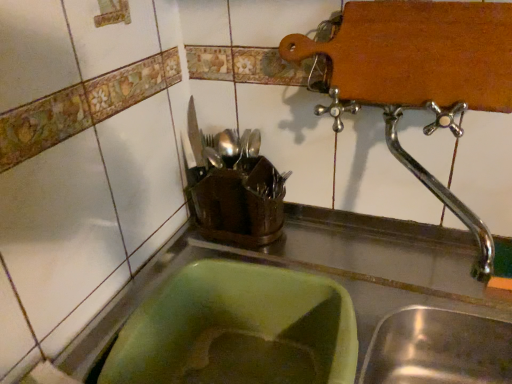
Find the location of `shiny silver cutlery at center, the 1th tableware from the right`. shiny silver cutlery at center, the 1th tableware from the right is located at coordinates pos(228,147).

At what (x,y) coordinates should I click in order to perform the action: click on metallic knife at upper center, marked as the 1th tableware in a left-to-right arrangement. Please return your answer as a coordinate pair (x, y). Looking at the image, I should click on 195,136.

At what (x,y) coordinates should I click in order to perform the action: click on green plastic sink at lower left. Please return your answer as a coordinate pair (x, y). Looking at the image, I should click on (319, 272).

This screenshot has width=512, height=384. Identify the location of shiny silver cutlery at center, marked as the 2th tableware in a left-to-right arrangement. (228, 147).

Is polished chrome tap at upper right smaller than shiny silver cutlery at center, the 1th tableware from the right?

No.

Can you tell me how much polished chrome tap at upper right and shiny silver cutlery at center, marked as the 2th tableware in a left-to-right arrangement, differ in facing direction?

2.29 degrees.

Which is correct: polished chrome tap at upper right is inside shiny silver cutlery at center, the 1th tableware from the right, or outside of it?

polished chrome tap at upper right is spatially situated outside shiny silver cutlery at center, the 1th tableware from the right.

Between polished chrome tap at upper right and metallic knife at upper center, which ranks as the 2th tableware in right-to-left order, which one has more height?

Standing taller between the two is polished chrome tap at upper right.

Is metallic knife at upper center, marked as the 1th tableware in a left-to-right arrangement, inside polished chrome tap at upper right?

No, polished chrome tap at upper right does not contain metallic knife at upper center, marked as the 1th tableware in a left-to-right arrangement.

Which of these two, polished chrome tap at upper right or metallic knife at upper center, marked as the 1th tableware in a left-to-right arrangement, is smaller?

metallic knife at upper center, marked as the 1th tableware in a left-to-right arrangement, is smaller.

From the image's perspective, is polished chrome tap at upper right below metallic knife at upper center, which ranks as the 2th tableware in right-to-left order?

Yes, from the image's perspective, polished chrome tap at upper right is below metallic knife at upper center, which ranks as the 2th tableware in right-to-left order.

Can you confirm if shiny silver cutlery at center, marked as the 2th tableware in a left-to-right arrangement, is bigger than green plastic sink at lower left?

No.

Between point (222, 159) and point (240, 249), which one is positioned in front?

The point (240, 249) is closer to the camera.

Are shiny silver cutlery at center, marked as the 2th tableware in a left-to-right arrangement, and green plastic sink at lower left beside each other?

shiny silver cutlery at center, marked as the 2th tableware in a left-to-right arrangement, is not next to green plastic sink at lower left, and they're not touching.

Does point (361, 334) come closer to viewer compared to point (223, 153)?

Yes, point (361, 334) is in front of point (223, 153).

Considering the sizes of objects green plastic sink at lower left and shiny silver cutlery at center, the 1th tableware from the right, in the image provided, who is bigger, green plastic sink at lower left or shiny silver cutlery at center, the 1th tableware from the right,?

Bigger between the two is green plastic sink at lower left.

From the image's perspective, starting from the green plastic sink at lower left, which tableware is the 1st one above? Please provide its 2D coordinates.

[(228, 147)]

Does green plastic sink at lower left come in front of shiny silver cutlery at center, marked as the 2th tableware in a left-to-right arrangement?

Yes, it is in front of shiny silver cutlery at center, marked as the 2th tableware in a left-to-right arrangement.

Consider the image. Is green plastic sink at lower left not inside polished chrome tap at upper right?

Absolutely, green plastic sink at lower left is external to polished chrome tap at upper right.

I want to click on tap that is behind the green plastic sink at lower left, so click(442, 196).

How many degrees apart are the facing directions of green plastic sink at lower left and polished chrome tap at upper right?

0.749 degrees.

Could you tell me if metallic knife at upper center, which ranks as the 2th tableware in right-to-left order, is turned towards shiny silver cutlery at center, the 1th tableware from the right?

No, metallic knife at upper center, which ranks as the 2th tableware in right-to-left order, is not oriented towards shiny silver cutlery at center, the 1th tableware from the right.

From a real-world perspective, does metallic knife at upper center, marked as the 1th tableware in a left-to-right arrangement, sit lower than shiny silver cutlery at center, marked as the 2th tableware in a left-to-right arrangement?

No, from a real-world perspective, metallic knife at upper center, marked as the 1th tableware in a left-to-right arrangement, is not under shiny silver cutlery at center, marked as the 2th tableware in a left-to-right arrangement.

Does point (196, 162) come in front of point (226, 160)?

No, (196, 162) is further to viewer.

Considering the sizes of objects metallic knife at upper center, marked as the 1th tableware in a left-to-right arrangement, and polished chrome tap at upper right in the image provided, who is taller, metallic knife at upper center, marked as the 1th tableware in a left-to-right arrangement, or polished chrome tap at upper right?

Standing taller between the two is polished chrome tap at upper right.

From a real-world perspective, relative to polished chrome tap at upper right, is metallic knife at upper center, which ranks as the 2th tableware in right-to-left order, vertically above or below?

metallic knife at upper center, which ranks as the 2th tableware in right-to-left order, is situated lower than polished chrome tap at upper right in the real world.

Looking at this image, between metallic knife at upper center, marked as the 1th tableware in a left-to-right arrangement, and polished chrome tap at upper right, which one appears on the left side from the viewer's perspective?

metallic knife at upper center, marked as the 1th tableware in a left-to-right arrangement.

From the image's perspective, is metallic knife at upper center, marked as the 1th tableware in a left-to-right arrangement, on top of polished chrome tap at upper right?

Correct, metallic knife at upper center, marked as the 1th tableware in a left-to-right arrangement, appears higher than polished chrome tap at upper right in the image.

The height and width of the screenshot is (384, 512). Find the location of `the 1st tableware behind the polished chrome tap at upper right, starting your count from the anchor`. the 1st tableware behind the polished chrome tap at upper right, starting your count from the anchor is located at coordinates (228, 147).

At what (x,y) coordinates should I click in order to perform the action: click on tap above the metallic knife at upper center, marked as the 1th tableware in a left-to-right arrangement (from a real-world perspective). Please return your answer as a coordinate pair (x, y). The height and width of the screenshot is (384, 512). Looking at the image, I should click on (442, 196).

From the image, which object appears to be nearer to green plastic sink at lower left, shiny silver cutlery at center, marked as the 2th tableware in a left-to-right arrangement, or polished chrome tap at upper right?

polished chrome tap at upper right is closer to green plastic sink at lower left.

Estimate the real-world distances between objects in this image. Which object is closer to shiny silver cutlery at center, the 1th tableware from the right, polished chrome tap at upper right or green plastic sink at lower left?

The object closer to shiny silver cutlery at center, the 1th tableware from the right, is green plastic sink at lower left.

From the image, which object appears to be nearer to metallic knife at upper center, marked as the 1th tableware in a left-to-right arrangement, shiny silver cutlery at center, marked as the 2th tableware in a left-to-right arrangement, or green plastic sink at lower left?

Based on the image, shiny silver cutlery at center, marked as the 2th tableware in a left-to-right arrangement, appears to be nearer to metallic knife at upper center, marked as the 1th tableware in a left-to-right arrangement.

Looking at this image, based on their spatial positions, is metallic knife at upper center, marked as the 1th tableware in a left-to-right arrangement, or shiny silver cutlery at center, the 1th tableware from the right, closer to green plastic sink at lower left?

shiny silver cutlery at center, the 1th tableware from the right, is positioned closer to the anchor green plastic sink at lower left.

When comparing their distances from shiny silver cutlery at center, marked as the 2th tableware in a left-to-right arrangement, does polished chrome tap at upper right or metallic knife at upper center, which ranks as the 2th tableware in right-to-left order, seem further?

Among the two, polished chrome tap at upper right is located further to shiny silver cutlery at center, marked as the 2th tableware in a left-to-right arrangement.

Which object lies nearer to the anchor point shiny silver cutlery at center, marked as the 2th tableware in a left-to-right arrangement, green plastic sink at lower left or metallic knife at upper center, marked as the 1th tableware in a left-to-right arrangement?

metallic knife at upper center, marked as the 1th tableware in a left-to-right arrangement, lies closer to shiny silver cutlery at center, marked as the 2th tableware in a left-to-right arrangement, than the other object.

Estimate the real-world distances between objects in this image. Which object is closer to metallic knife at upper center, marked as the 1th tableware in a left-to-right arrangement, polished chrome tap at upper right or shiny silver cutlery at center, the 1th tableware from the right?

The object closer to metallic knife at upper center, marked as the 1th tableware in a left-to-right arrangement, is shiny silver cutlery at center, the 1th tableware from the right.

In the scene shown: Considering their positions, is polished chrome tap at upper right positioned closer to metallic knife at upper center, which ranks as the 2th tableware in right-to-left order, than green plastic sink at lower left?

green plastic sink at lower left.

This screenshot has height=384, width=512. Find the location of `tap positioned between green plastic sink at lower left and shiny silver cutlery at center, the 1th tableware from the right, from near to far`. tap positioned between green plastic sink at lower left and shiny silver cutlery at center, the 1th tableware from the right, from near to far is located at coordinates (442, 196).

This screenshot has height=384, width=512. What are the coordinates of `tableware between polished chrome tap at upper right and metallic knife at upper center, marked as the 1th tableware in a left-to-right arrangement, along the z-axis` in the screenshot? It's located at (228, 147).

Identify the location of tap located between green plastic sink at lower left and metallic knife at upper center, which ranks as the 2th tableware in right-to-left order, in the depth direction. (442, 196).

At what (x,y) coordinates should I click in order to perform the action: click on tableware located between green plastic sink at lower left and metallic knife at upper center, which ranks as the 2th tableware in right-to-left order, in the depth direction. Please return your answer as a coordinate pair (x, y). This screenshot has height=384, width=512. Looking at the image, I should click on point(228,147).